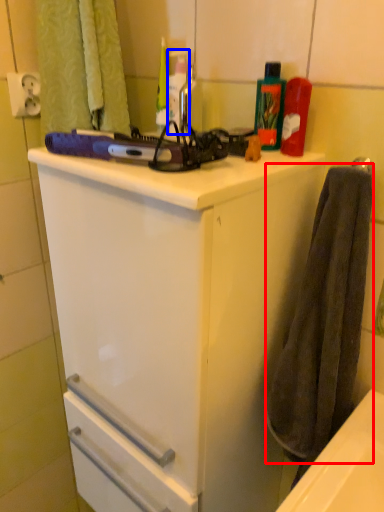
Question: Which of the following is the closest to the observer, bath towel (highlighted by a red box) or bottle (highlighted by a blue box)?

Choices:
 (A) bath towel
 (B) bottle

Answer: (A)